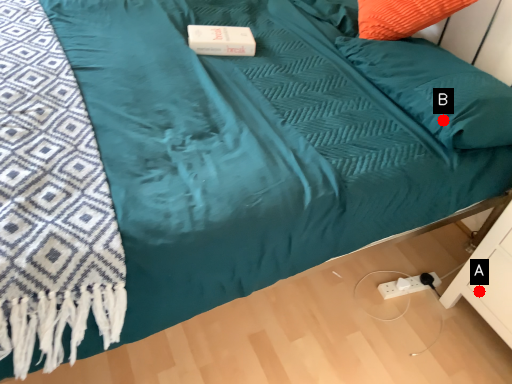
Question: Two points are circled on the image, labeled by A and B beside each circle. Among these points, which one is farthest from the camera?

Choices:
 (A) A is further
 (B) B is further

Answer: (A)